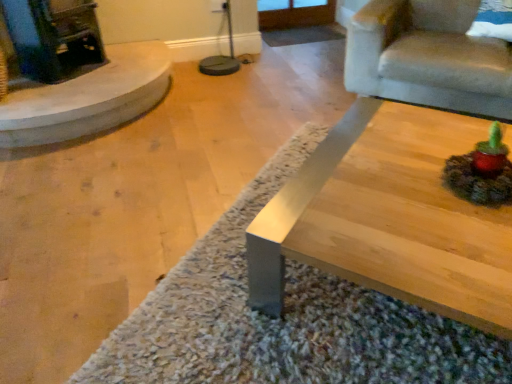
Question: From a real-world perspective, is shaggy carpet at center located higher than velvet beige armchair at upper right?

Choices:
 (A) no
 (B) yes

Answer: (A)

Question: Considering the relative positions of shaggy carpet at center and velvet beige armchair at upper right in the image provided, is shaggy carpet at center behind velvet beige armchair at upper right?

Choices:
 (A) yes
 (B) no

Answer: (B)

Question: Is velvet beige armchair at upper right inside shaggy carpet at center?

Choices:
 (A) no
 (B) yes

Answer: (A)

Question: Does shaggy carpet at center have a lesser width compared to velvet beige armchair at upper right?

Choices:
 (A) yes
 (B) no

Answer: (B)

Question: Does shaggy carpet at center have a lesser height compared to velvet beige armchair at upper right?

Choices:
 (A) no
 (B) yes

Answer: (B)

Question: Looking at their shapes, would you say shaggy carpet at center is wider or thinner than velvet beige armchair at upper right?

Choices:
 (A) thin
 (B) wide

Answer: (B)

Question: Is shaggy carpet at center in front of or behind velvet beige armchair at upper right in the image?

Choices:
 (A) behind
 (B) front

Answer: (B)

Question: From a real-world perspective, is shaggy carpet at center above or below velvet beige armchair at upper right?

Choices:
 (A) above
 (B) below

Answer: (B)

Question: In terms of height, does shaggy carpet at center look taller or shorter compared to velvet beige armchair at upper right?

Choices:
 (A) tall
 (B) short

Answer: (B)

Question: Based on their positions, is shaggy carpet at center located to the left or right of smooth beige fireplace at left?

Choices:
 (A) right
 (B) left

Answer: (A)

Question: In terms of width, does shaggy carpet at center look wider or thinner when compared to smooth beige fireplace at left?

Choices:
 (A) thin
 (B) wide

Answer: (A)

Question: From their relative heights in the image, would you say shaggy carpet at center is taller or shorter than smooth beige fireplace at left?

Choices:
 (A) tall
 (B) short

Answer: (B)

Question: Is shaggy carpet at center in front of or behind smooth beige fireplace at left in the image?

Choices:
 (A) front
 (B) behind

Answer: (A)

Question: From a real-world perspective, is velvet beige armchair at upper right positioned above or below shaggy carpet at center?

Choices:
 (A) below
 (B) above

Answer: (B)

Question: In terms of width, does velvet beige armchair at upper right look wider or thinner when compared to shaggy carpet at center?

Choices:
 (A) wide
 (B) thin

Answer: (B)